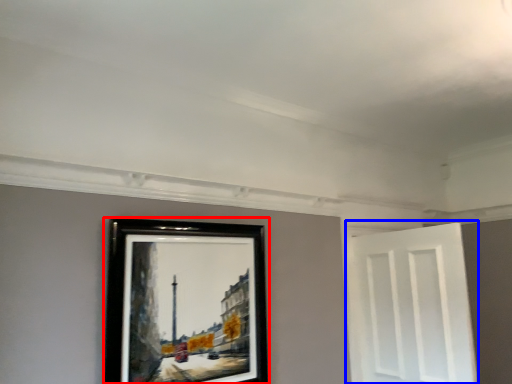
Question: Which object appears closest to the camera in this image, picture frame (highlighted by a red box) or door (highlighted by a blue box)?

Choices:
 (A) picture frame
 (B) door

Answer: (A)